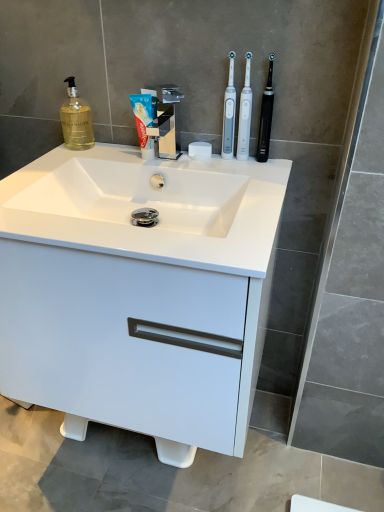
Question: Is white plastic toothbrush at upper right, the first toothbrush positioned from the left, to the left or to the right of white matte soap at center in the image?

Choices:
 (A) right
 (B) left

Answer: (A)

Question: From the image's perspective, is white plastic toothbrush at upper right, arranged as the third toothbrush when viewed from the right, located above or below white matte soap at center?

Choices:
 (A) above
 (B) below

Answer: (A)

Question: Which of these objects is positioned closest to the white glossy toothpaste at center?

Choices:
 (A) white plastic toothbrush at upper right, arranged as the third toothbrush when viewed from the right
 (B) polished chrome faucet at center
 (C) white matte soap at center
 (D) black rubberized toothbrush at upper right, placed as the 1th toothbrush when sorted from right to left
 (E) white glossy sink at center

Answer: (B)

Question: Estimate the real-world distances between objects in this image. Which object is farther from the white plastic toothbrush at upper right, positioned as the 2th toothbrush in right-to-left order?

Choices:
 (A) white glossy toothpaste at center
 (B) white glossy cabinet at center
 (C) black rubberized toothbrush at upper right, placed as the 1th toothbrush when sorted from right to left
 (D) white glossy sink at center
 (E) white plastic toothbrush at upper right, arranged as the third toothbrush when viewed from the right

Answer: (B)